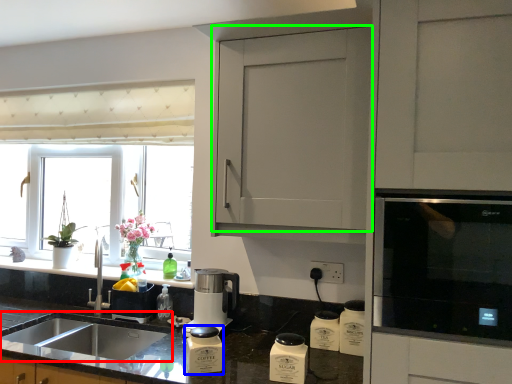
Question: Considering the real-world distances, which object is farthest from sink (highlighted by a red box)? appliance (highlighted by a blue box) or cabinetry (highlighted by a green box)?

Choices:
 (A) appliance
 (B) cabinetry

Answer: (B)